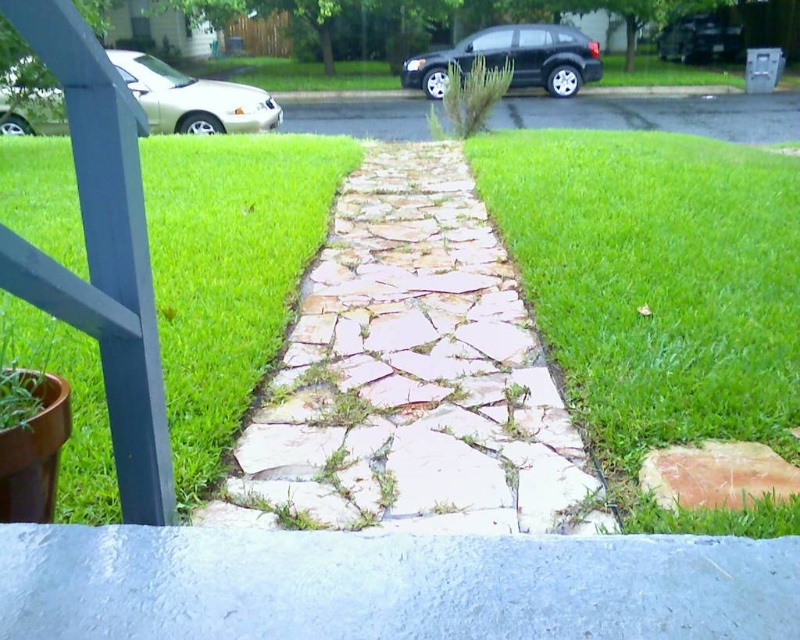
Can you confirm if green grass at center is positioned to the left of silver metallic sedan at upper left?

Incorrect, green grass at center is not on the left side of silver metallic sedan at upper left.

Consider the image. Can you confirm if green grass at center is smaller than silver metallic sedan at upper left?

Incorrect, green grass at center is not smaller in size than silver metallic sedan at upper left.

Between point (760, 307) and point (148, 125), which one is positioned in front?

Point (760, 307)

This screenshot has height=640, width=800. Find the location of `green grass at center`. green grass at center is located at coordinates (658, 296).

Does point (57, 516) lie in front of point (22, 131)?

Yes, it is.

In the scene shown: Who is positioned more to the right, green grass at left or silver metallic sedan at upper left?

green grass at left

The width and height of the screenshot is (800, 640). Describe the element at coordinates (228, 272) in the screenshot. I see `green grass at left` at that location.

Find the location of a particular element. The width and height of the screenshot is (800, 640). green grass at left is located at coordinates (228, 272).

Can you confirm if green grass at center is bigger than green grass at left?

Yes, green grass at center is bigger than green grass at left.

Can you confirm if green grass at center is positioned above green grass at left?

No.

Who is more distant from viewer, [602,464] or [44,344]?

The point [44,344] is more distant.

You are a GUI agent. You are given a task and a screenshot of the screen. Output one action in this format:
    pyautogui.click(x=<x>, y=<y>)
    Task: Click on the green grass at center
    
    Given the screenshot: What is the action you would take?
    pyautogui.click(x=658, y=296)